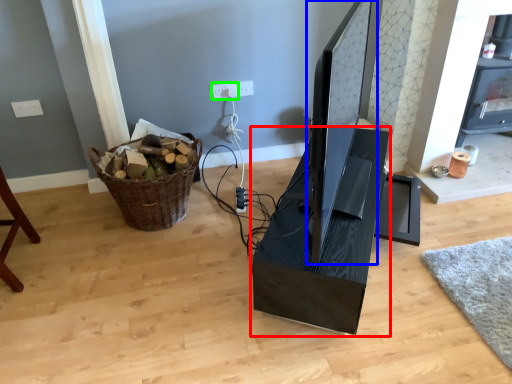
Question: Based on their relative distances, which object is nearer to computer desk (highlighted by a red box)? Choose from computer monitor (highlighted by a blue box) and electric outlet (highlighted by a green box).

Choices:
 (A) computer monitor
 (B) electric outlet

Answer: (A)